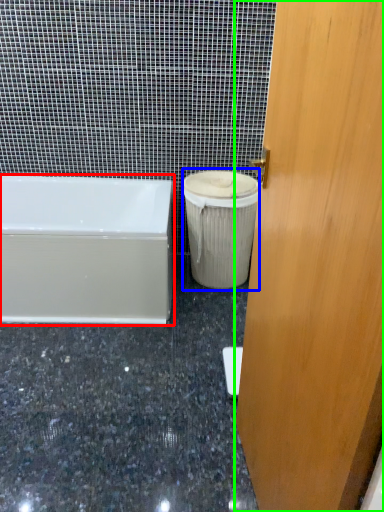
Question: Which object is positioned closest to bathtub (highlighted by a red box)? Select from garbage (highlighted by a blue box) and door (highlighted by a green box).

Choices:
 (A) garbage
 (B) door

Answer: (A)